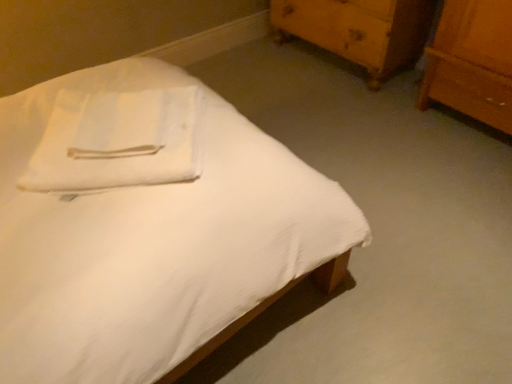
You are a GUI agent. You are given a task and a screenshot of the screen. Output one action in this format:
    pyautogui.click(x=<x>, y=<y>)
    Task: Click on the blank space to the left of wooden chest of drawers at upper right
    The height and width of the screenshot is (384, 512).
    Given the screenshot: What is the action you would take?
    pyautogui.click(x=255, y=72)